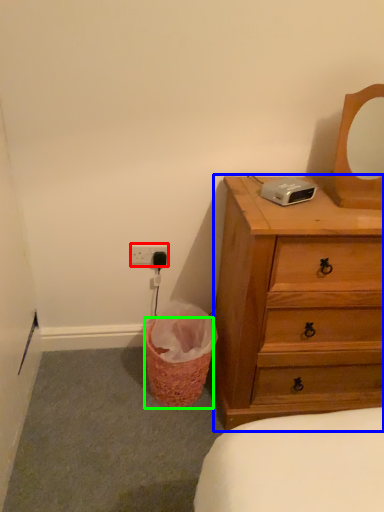
Question: Based on their relative distances, which object is nearer to electric outlet (highlighted by a red box)? Choose from chest of drawers (highlighted by a blue box) and basket (highlighted by a green box).

Choices:
 (A) chest of drawers
 (B) basket

Answer: (B)